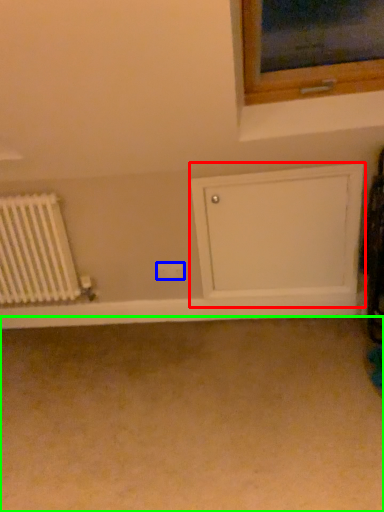
Question: Which is nearer to the shelf (highlighted by a red box)? electric outlet (highlighted by a blue box) or plain (highlighted by a green box).

Choices:
 (A) electric outlet
 (B) plain

Answer: (A)